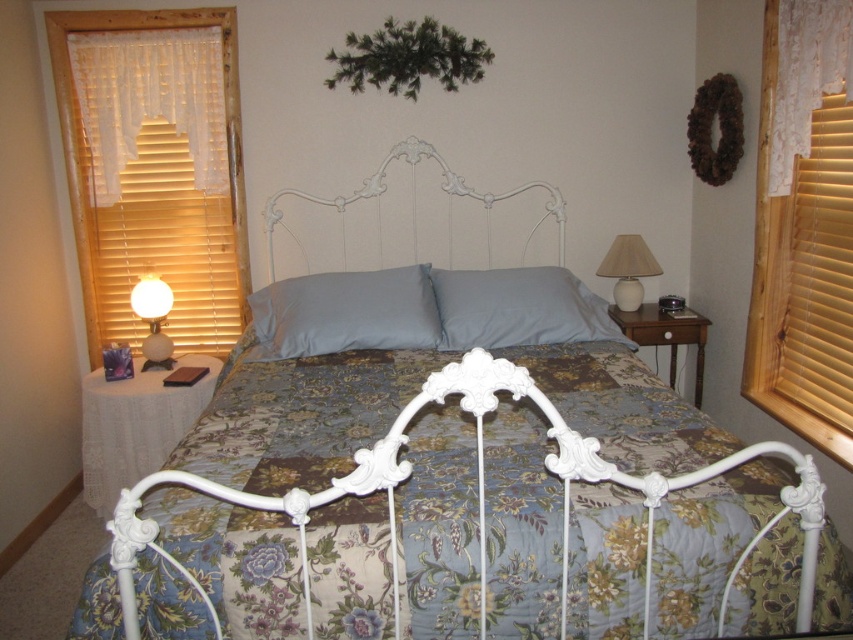
Which is below, floral fabric bed at center or light blue fabric pillow at center?

floral fabric bed at center is below.

Does floral fabric bed at center lie in front of light blue fabric pillow at center?

Yes, floral fabric bed at center is closer to the viewer.

Does point (74, 618) come farther from viewer compared to point (502, 298)?

No, it is in front of (502, 298).

Where is `floral fabric bed at center`? floral fabric bed at center is located at coordinates pos(451,493).

Looking at this image, how much distance is there between wooden blinds at left and matte white glass lamp at left?

They are 19.75 inches apart.

Can you confirm if wooden blinds at left is taller than matte white glass lamp at left?

Correct, wooden blinds at left is much taller as matte white glass lamp at left.

I want to click on wooden blinds at left, so click(78, 132).

In the scene shown: Does wooden blinds at right appear under wooden blinds at left?

Yes, wooden blinds at right is below wooden blinds at left.

Consider the image. Does wooden blinds at right appear on the right side of wooden blinds at left?

Yes, wooden blinds at right is to the right of wooden blinds at left.

Is point (780, 52) closer to camera compared to point (231, 64)?

Yes.

Identify the location of wooden blinds at right. (802, 273).